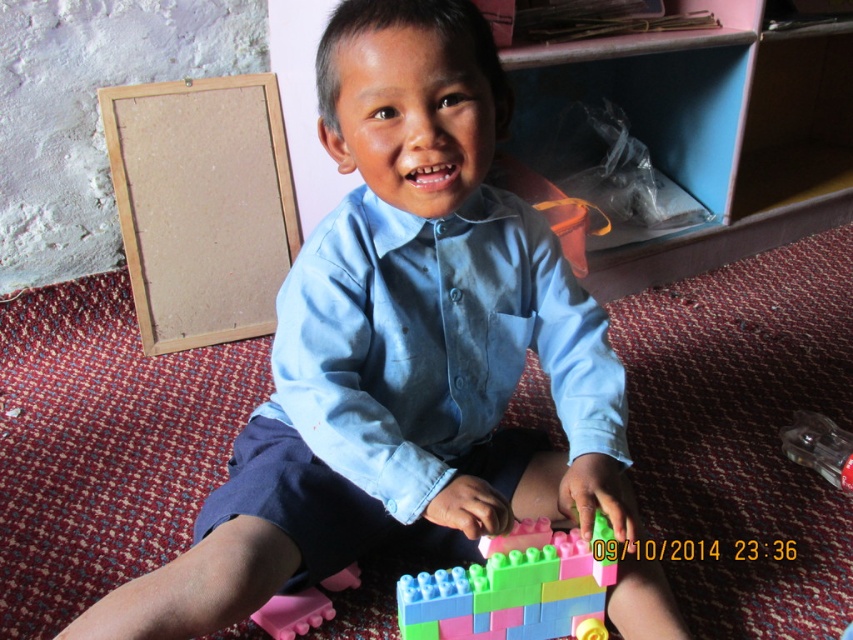
Consider the image. Who is positioned more to the left, light blue cotton shirt at center or pink rubber toy at lower left?

Positioned to the left is pink rubber toy at lower left.

Is light blue cotton shirt at center further to camera compared to pink rubber toy at lower left?

No.

Which is behind, point (323, 221) or point (316, 616)?

The point (316, 616) is behind.

Where is `light blue cotton shirt at center`? This screenshot has height=640, width=853. light blue cotton shirt at center is located at coordinates (434, 342).

Where is `light blue cotton shirt at center`? The height and width of the screenshot is (640, 853). light blue cotton shirt at center is located at coordinates (434, 342).

Who is more distant from viewer, (173, 298) or (553, 632)?

Positioned behind is point (173, 298).

Does bare wood frame at upper left appear under pastel plastic blocks at lower center?

No, bare wood frame at upper left is not below pastel plastic blocks at lower center.

What are the coordinates of `bare wood frame at upper left` in the screenshot? It's located at (201, 205).